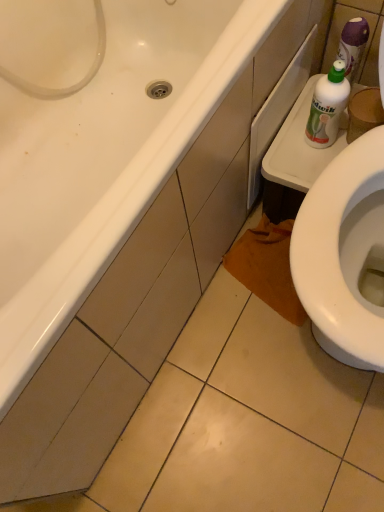
Locate an element on the screen. This screenshot has height=512, width=384. vacant point to the left of green plastic bottle at upper right is located at coordinates (285, 155).